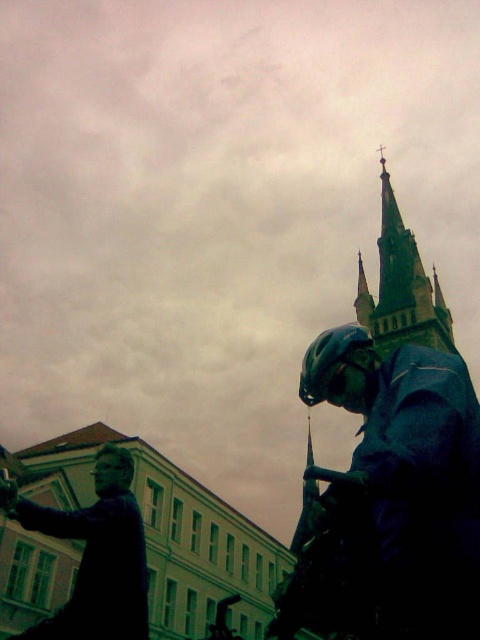
Which is more to the right, shiny dark blue helmet at center or stone steeple at upper center?

stone steeple at upper center is more to the right.

Where is `shiny dark blue helmet at center`? The image size is (480, 640). shiny dark blue helmet at center is located at coordinates (391, 499).

Describe the element at coordinates (391, 499) in the screenshot. I see `shiny dark blue helmet at center` at that location.

Does shiny dark blue helmet at center have a lesser height compared to matte black statue at lower left?

No, shiny dark blue helmet at center is not shorter than matte black statue at lower left.

What do you see at coordinates (391, 499) in the screenshot? This screenshot has width=480, height=640. I see `shiny dark blue helmet at center` at bounding box center [391, 499].

Locate an element on the screen. Image resolution: width=480 pixels, height=640 pixels. shiny dark blue helmet at center is located at coordinates (391, 499).

Between matte black statue at lower left and stone steeple at upper center, which one appears on the left side from the viewer's perspective?

matte black statue at lower left is more to the left.

How far apart are matte black statue at lower left and stone steeple at upper center?

matte black statue at lower left is 90.77 meters from stone steeple at upper center.

What are the coordinates of `matte black statue at lower left` in the screenshot? It's located at (95, 554).